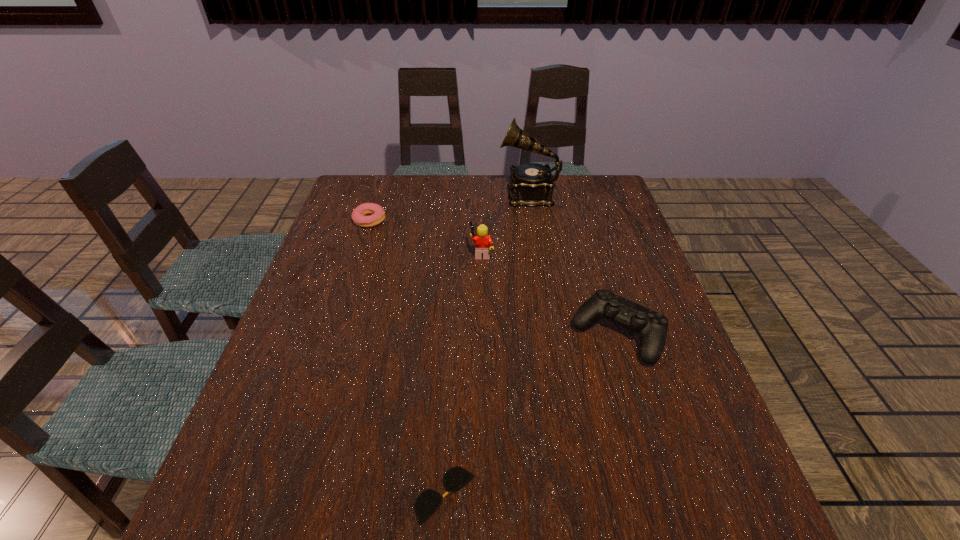
Choose which object is the nearest neighbor to the farthest object. Please provide its 2D coordinates. Your answer should be formatted as a tuple, i.e. [(x, y)], where the tuple contains the x and y coordinates of a point satisfying the conditions above.

[(483, 242)]

You are a GUI agent. You are given a task and a screenshot of the screen. Output one action in this format:
    pyautogui.click(x=<x>, y=<y>)
    Task: Click on the vacant space that satisfies the following two spatial constraints: 1. in front of the third farthest object with the accessory visible; 2. on the back side of the control
    The image size is (960, 540).
    Given the screenshot: What is the action you would take?
    pyautogui.click(x=482, y=334)

Where is `free space in the image that satisfies the following two spatial constraints: 1. in front of the third farthest object with the accessory visible; 2. on the front side of the shortest object`? The height and width of the screenshot is (540, 960). free space in the image that satisfies the following two spatial constraints: 1. in front of the third farthest object with the accessory visible; 2. on the front side of the shortest object is located at coordinates click(x=483, y=495).

Identify the location of free space in the image that satisfies the following two spatial constraints: 1. on the front side of the doughnut; 2. on the left side of the spectacles. (281, 495).

You are a GUI agent. You are given a task and a screenshot of the screen. Output one action in this format:
    pyautogui.click(x=<x>, y=<y>)
    Task: Click on the blank area in the image that satisfies the following two spatial constraints: 1. on the back side of the third shortest object; 2. on the horn of the tallest object
    The width and height of the screenshot is (960, 540).
    Given the screenshot: What is the action you would take?
    pyautogui.click(x=575, y=194)

In order to click on free space that satisfies the following two spatial constraints: 1. on the front side of the nearest object; 2. on the right side of the fourth tallest object in this screenshot , I will do `click(281, 495)`.

I want to click on free space that satisfies the following two spatial constraints: 1. in front of the Lego with the accessory visible; 2. on the front side of the nearest object, so click(483, 495).

Find the location of a particular element. This screenshot has width=960, height=540. vacant space that satisfies the following two spatial constraints: 1. on the back side of the shortest object; 2. on the left side of the third shortest object is located at coordinates (454, 334).